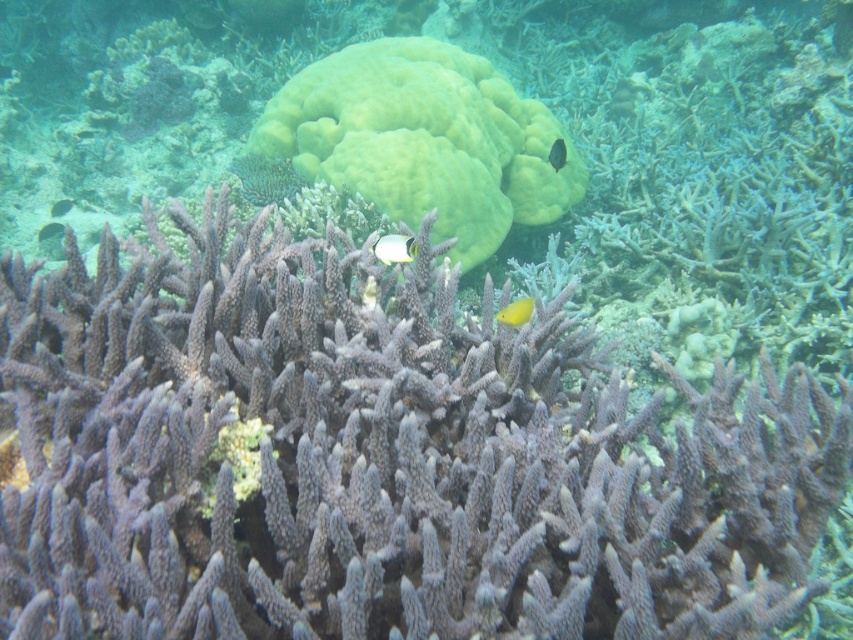
Question: Is green matte coral at center to the left of white glossy fish at center from the viewer's perspective?

Choices:
 (A) no
 (B) yes

Answer: (A)

Question: Observing the image, what is the correct spatial positioning of green matte coral at center in reference to white glossy fish at center?

Choices:
 (A) below
 (B) above

Answer: (B)

Question: Does green matte coral at center appear under translucent yellow fish at center?

Choices:
 (A) yes
 (B) no

Answer: (A)

Question: Which of the following is the farthest from the observer?

Choices:
 (A) yellow matte fish at center
 (B) shiny black fish at center
 (C) white glossy fish at center
 (D) translucent yellow fish at center

Answer: (D)

Question: Estimate the real-world distances between objects in this image. Which object is closer to the shiny black fish at center?

Choices:
 (A) translucent yellow fish at center
 (B) shiny silver fish at lower left
 (C) white glossy fish at center

Answer: (C)

Question: Which of the following is the farthest from the observer?

Choices:
 (A) (61, 198)
 (B) (380, 243)
 (C) (556, 152)

Answer: (A)